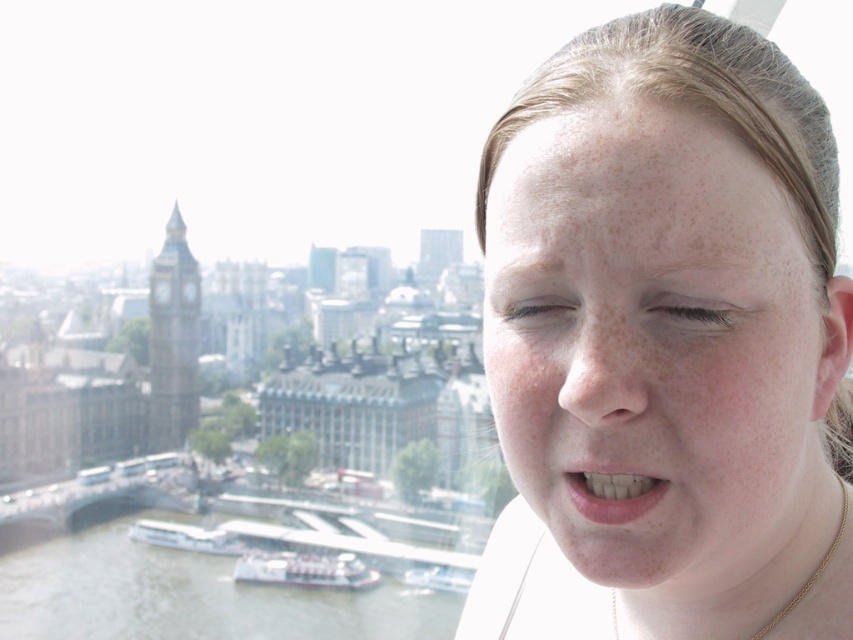
Question: Among these objects, which one is nearest to the camera?

Choices:
 (A) smooth skin face at center
 (B) clear water at lower left

Answer: (A)

Question: Where is smooth skin face at center located in relation to white plastic boat at lower left in the image?

Choices:
 (A) right
 (B) left

Answer: (A)

Question: Is white plastic boat at lower center to the left of smooth pink lips at lower center from the viewer's perspective?

Choices:
 (A) no
 (B) yes

Answer: (B)

Question: Which point is farther to the camera?

Choices:
 (A) (842, 506)
 (B) (189, 572)
 (C) (173, 529)

Answer: (C)

Question: Is smooth skin face at center to the left of clear water at lower left from the viewer's perspective?

Choices:
 (A) no
 (B) yes

Answer: (A)

Question: Which of the following is the closest to the observer?

Choices:
 (A) (358, 566)
 (B) (720, 243)
 (C) (196, 532)

Answer: (B)